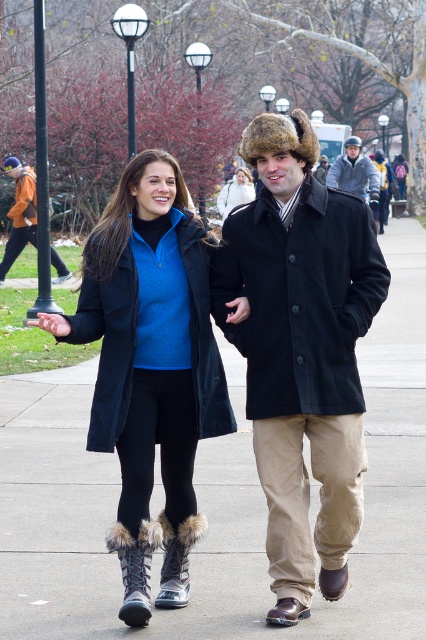
The height and width of the screenshot is (640, 426). Describe the element at coordinates (299, 298) in the screenshot. I see `black wool coat at center` at that location.

Is point (296, 305) farther from viewer compared to point (235, 189)?

No, (296, 305) is closer to viewer.

Identify the location of black wool coat at center. (299, 298).

You are a GUI agent. You are given a task and a screenshot of the screen. Output one action in this format:
    pyautogui.click(x=<x>, y=<y>)
    Task: Click on the black wool coat at center
    Image resolution: width=426 pixels, height=640 pixels.
    Given the screenshot: What is the action you would take?
    pyautogui.click(x=299, y=298)

Does dark brown fur hat at center have a larger size compared to fur-lined boots at center?

Incorrect, dark brown fur hat at center is not larger than fur-lined boots at center.

Which is more to the right, dark brown fur hat at center or fur-lined boots at center?

dark brown fur hat at center is more to the right.

Does point (285, 440) lie in front of point (183, 404)?

Yes, it is in front of point (183, 404).

Image resolution: width=426 pixels, height=640 pixels. What are the coordinates of `dark brown fur hat at center` in the screenshot? It's located at (301, 349).

Does matte black coat at center have a lesser width compared to matte blue sweater at center?

No, matte black coat at center is not thinner than matte blue sweater at center.

Consider the image. Who is more distant from viewer, (187,237) or (247,189)?

Point (247,189)

I want to click on matte black coat at center, so click(109, 346).